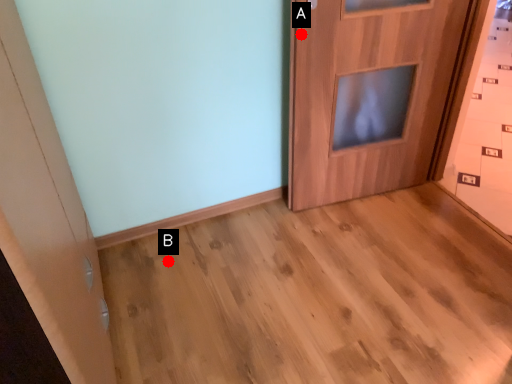
Question: Two points are circled on the image, labeled by A and B beside each circle. Which point is farther from the camera taking this photo?

Choices:
 (A) A is further
 (B) B is further

Answer: (B)